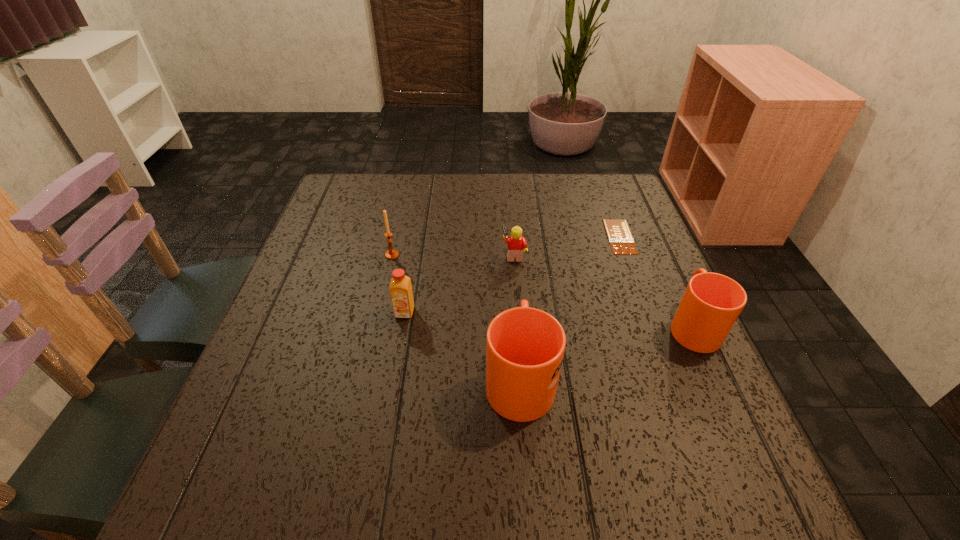
In order to click on free spot between the chocolate bar and the left mug in this screenshot , I will do `click(569, 307)`.

You are a GUI agent. You are given a task and a screenshot of the screen. Output one action in this format:
    pyautogui.click(x=<x>, y=<y>)
    Task: Click on the free space between the right mug and the leftmost object
    
    Given the screenshot: What is the action you would take?
    pyautogui.click(x=542, y=290)

Identify the location of free space between the candle_holder and the shorter mug. (542, 290).

Locate an element on the screen. free space that is in between the taller mug and the orange juice is located at coordinates (462, 345).

Locate an element on the screen. vacant space in between the shortest object and the candle_holder is located at coordinates (506, 246).

Locate an element on the screen. This screenshot has height=540, width=960. free space between the Lego and the shorter mug is located at coordinates (603, 290).

Point out which object is positioned as the third nearest to the chocolate bar. Please provide its 2D coordinates. Your answer should be formatted as a tuple, i.e. [(x, y)], where the tuple contains the x and y coordinates of a point satisfying the conditions above.

[(525, 346)]

The height and width of the screenshot is (540, 960). I want to click on object that is the fourth closest to the chocolate bar, so click(x=400, y=287).

Where is `free space that satisfies the following two spatial constraints: 1. on the handle side of the left mug; 2. on the left side of the shortest object`? free space that satisfies the following two spatial constraints: 1. on the handle side of the left mug; 2. on the left side of the shortest object is located at coordinates (509, 237).

The image size is (960, 540). In order to click on vacant space that satisfies the following two spatial constraints: 1. on the handle side of the taller mug; 2. on the right side of the shortest object in this screenshot , I will do `click(509, 237)`.